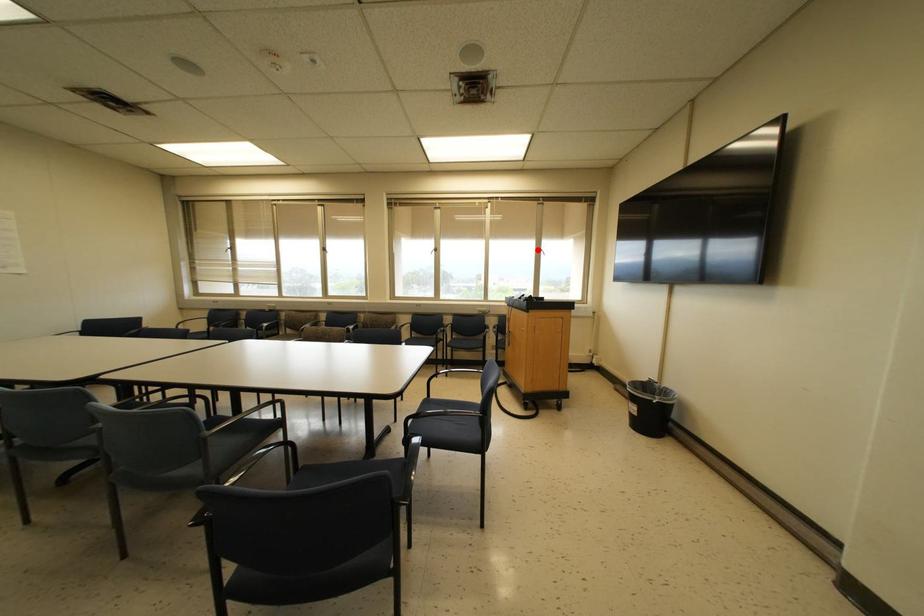
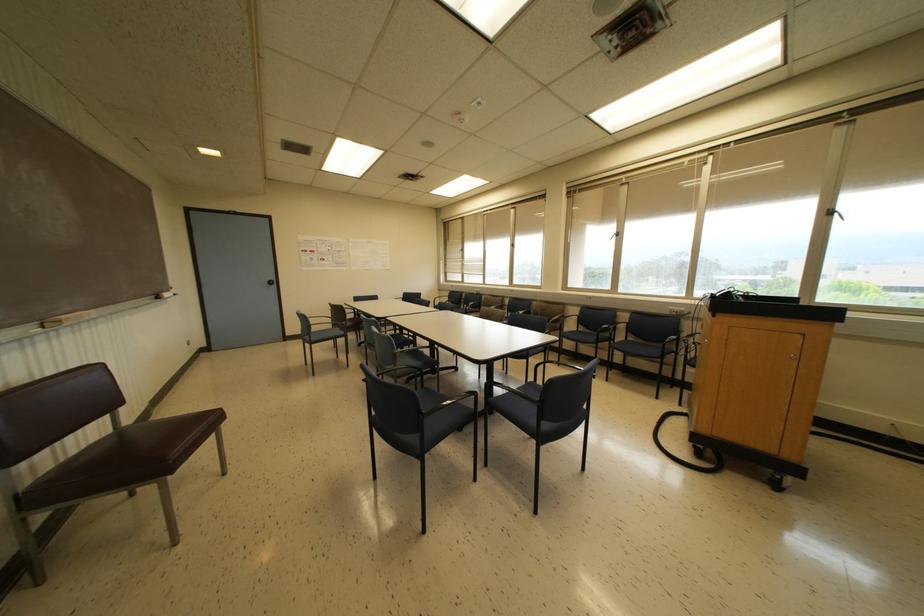
In the second image, find the point that corresponds to the highlighted location in the first image.

(827, 213)